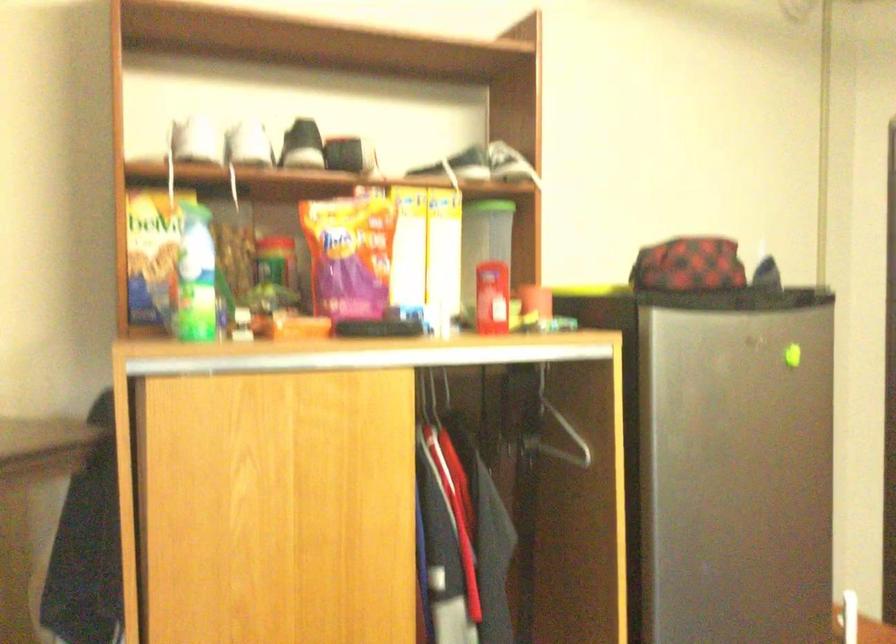
Where would you squeez the green and blue bottle? Please return your answer as a coordinate pair (x, y).

(195, 277)